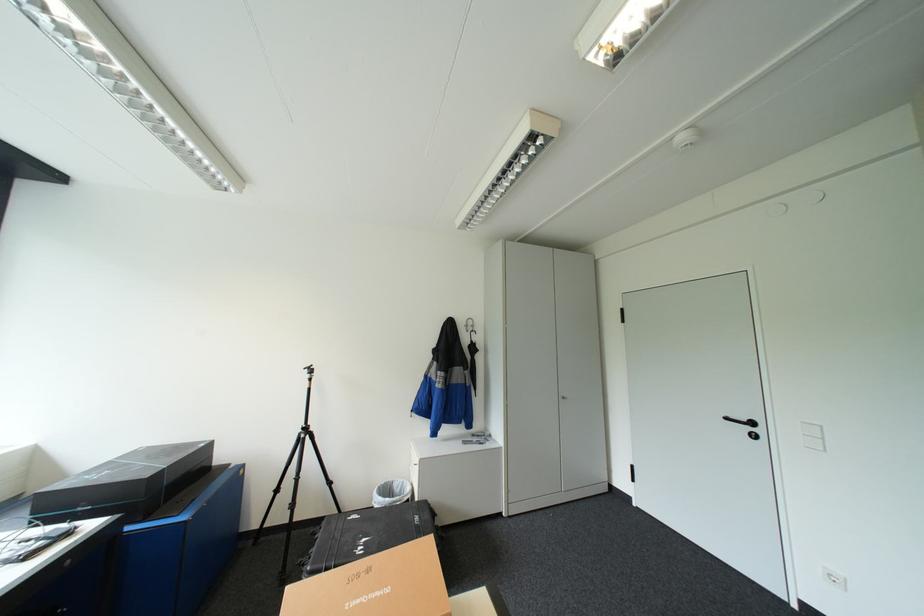
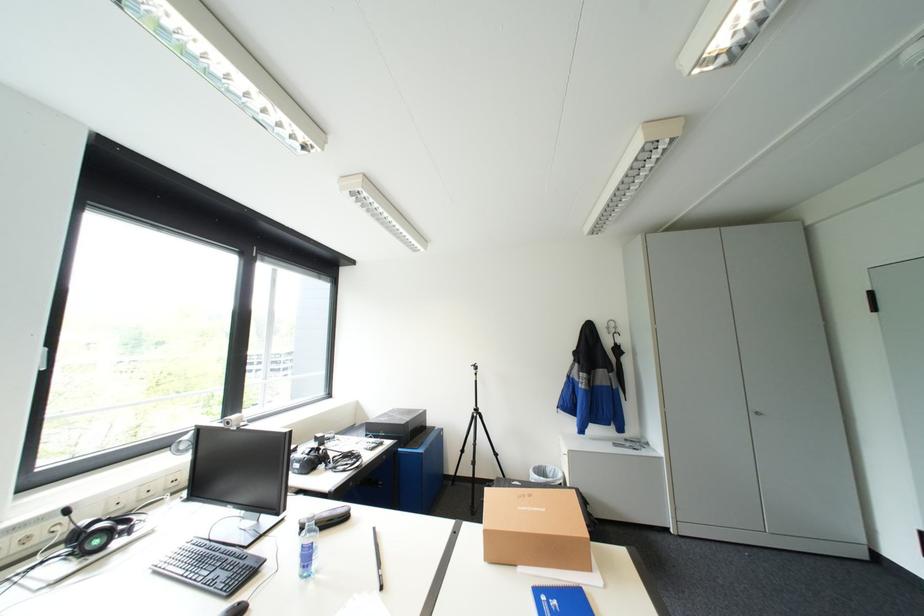
Question: The first image is from the beginning of the video and the second image is from the end. How did the camera likely rotate when shooting the video?

Choices:
 (A) Left
 (B) Right
 (C) Up
 (D) Down

Answer: (A)